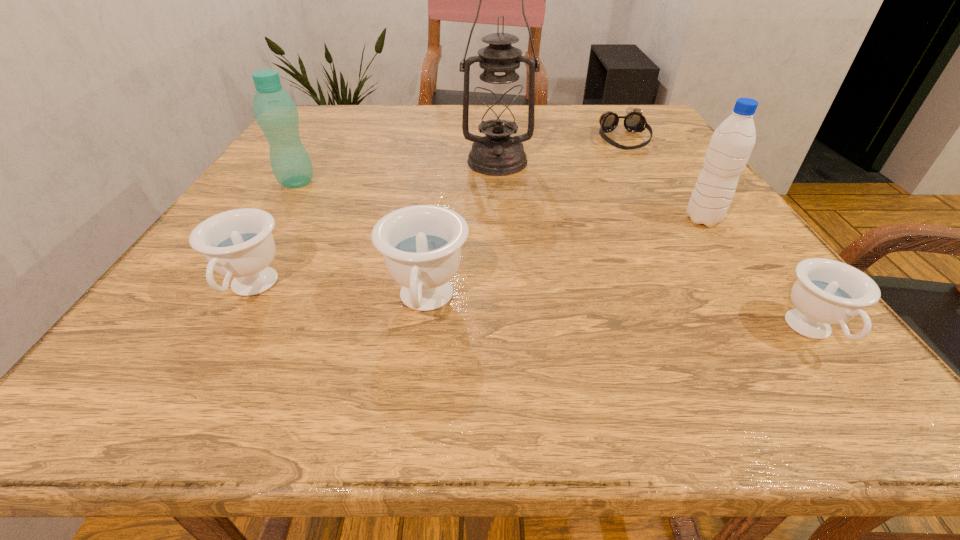
Identify the location of the third shortest object. The width and height of the screenshot is (960, 540). (238, 243).

Find the location of a particular element. the second shortest teacup is located at coordinates (238, 243).

The image size is (960, 540). What are the coordinates of `the second teacup from right to left` in the screenshot? It's located at (421, 245).

Identify the location of the rightmost teacup. (827, 291).

Locate an element on the screen. the shortest teacup is located at coordinates (827, 291).

I want to click on the shortest object, so click(x=634, y=121).

Locate an element on the screen. the tallest object is located at coordinates (498, 104).

The width and height of the screenshot is (960, 540). I want to click on the fourth farthest object, so click(x=731, y=144).

Where is `bottle`? The width and height of the screenshot is (960, 540). bottle is located at coordinates (276, 113).

Image resolution: width=960 pixels, height=540 pixels. I want to click on free location located 0.080m through the lenses of the shortest object, so click(x=639, y=168).